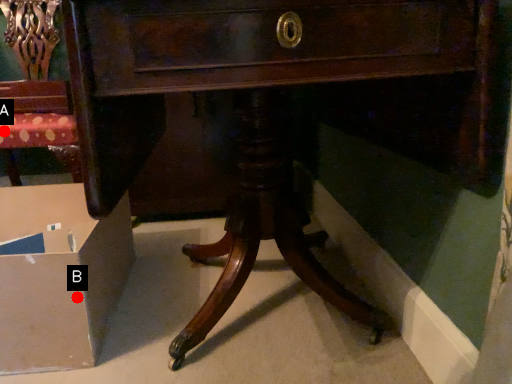
Question: Two points are circled on the image, labeled by A and B beside each circle. Which point appears farthest from the camera in this image?

Choices:
 (A) A is further
 (B) B is further

Answer: (A)